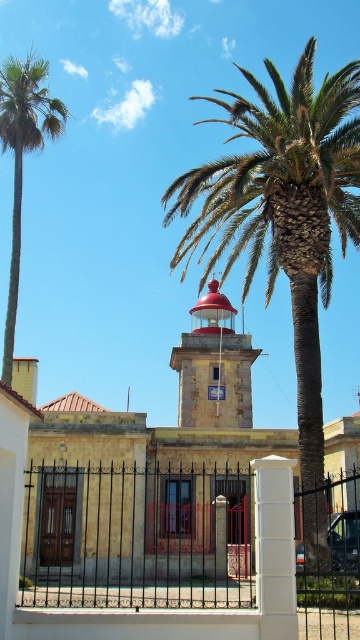
Is iron/golden gate at center to the left of red painted metal bell tower at center from the viewer's perspective?

Indeed, iron/golden gate at center is positioned on the left side of red painted metal bell tower at center.

Can you confirm if iron/golden gate at center is positioned above red painted metal bell tower at center?

No.

Image resolution: width=360 pixels, height=640 pixels. What are the coordinates of `iron/golden gate at center` in the screenshot? It's located at (183, 556).

Which is more to the left, green leafy palm at center or green leafy palm at left?

Positioned to the left is green leafy palm at left.

Between green leafy palm at center and green leafy palm at left, which one is positioned higher?

green leafy palm at left is higher up.

Is point (325, 180) farther from viewer compared to point (36, 138)?

No, (325, 180) is closer to viewer.

Identify the location of green leafy palm at center. (285, 225).

Can you confirm if iron/golden gate at center is smaller than green leafy palm at left?

Yes, iron/golden gate at center is smaller than green leafy palm at left.

The height and width of the screenshot is (640, 360). Describe the element at coordinates (183, 556) in the screenshot. I see `iron/golden gate at center` at that location.

Which is behind, point (132, 561) or point (2, 90)?

The point (132, 561) is more distant.

Identify the location of iron/golden gate at center. (183, 556).